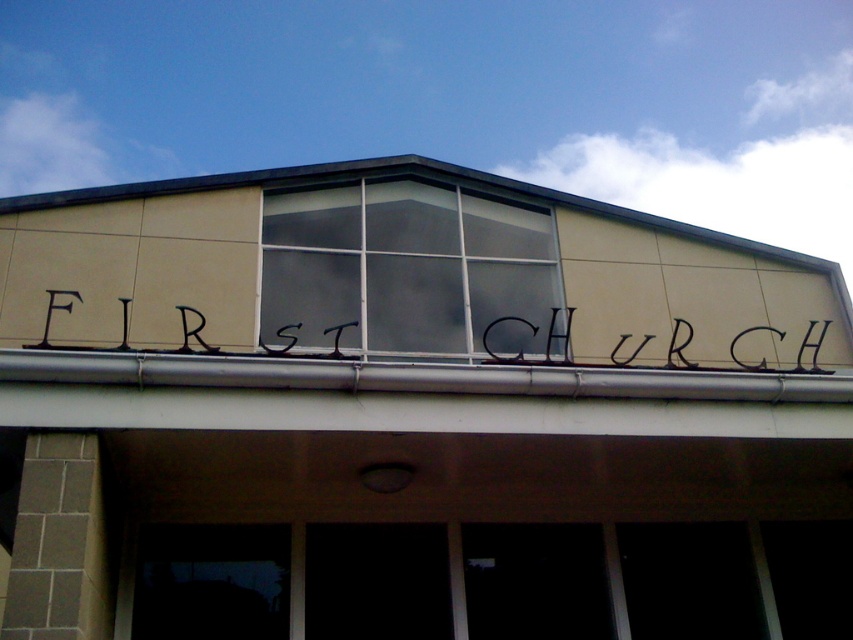
Question: Does black wrought iron sign at center appear under black metal sign at upper center?

Choices:
 (A) yes
 (B) no

Answer: (B)

Question: Is clear glass window at center above black wrought iron sign at center?

Choices:
 (A) yes
 (B) no

Answer: (A)

Question: Among these points, which one is nearest to the camera?

Choices:
 (A) (537, 364)
 (B) (364, 284)
 (C) (349, 358)

Answer: (C)

Question: Is clear glass window at center in front of black metal sign at upper center?

Choices:
 (A) yes
 (B) no

Answer: (B)

Question: Among these points, which one is farthest from the camera?

Choices:
 (A) (538, 360)
 (B) (434, 339)
 (C) (828, 320)

Answer: (C)

Question: Which point is closer to the camera?

Choices:
 (A) (482, 337)
 (B) (653, 337)
 (C) (454, 284)

Answer: (A)